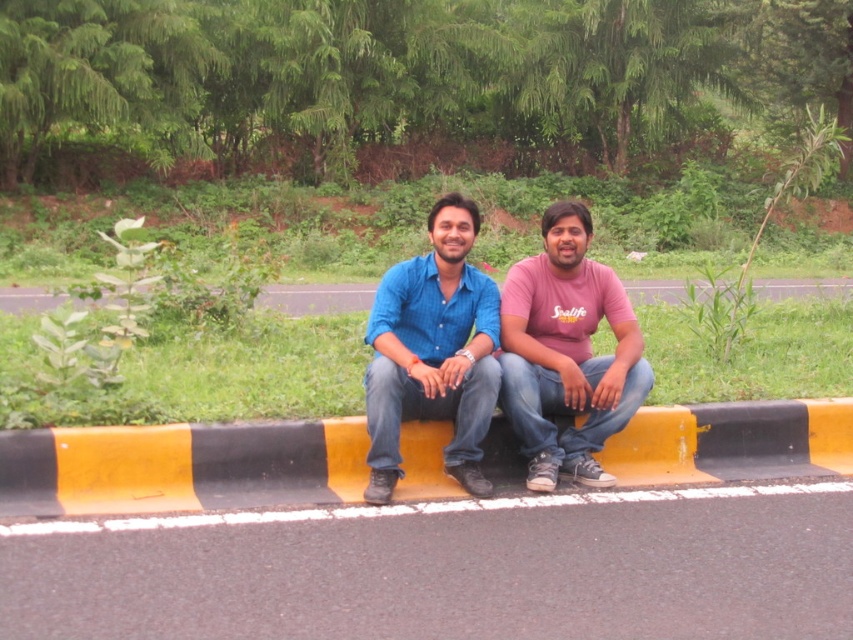
Question: Estimate the real-world distances between objects in this image. Which object is closer to the matte blue shirt at center?

Choices:
 (A) pink matte shirt at center
 (B) yellow/black striped curb at center
 (C) blue denim jeans at center

Answer: (C)

Question: Can you confirm if yellow/black striped curb at center is positioned below blue denim jeans at center?

Choices:
 (A) yes
 (B) no

Answer: (A)

Question: Is yellow/black striped curb at center behind pink matte shirt at center?

Choices:
 (A) yes
 (B) no

Answer: (B)

Question: Considering the real-world distances, which object is farthest from the blue denim jeans at center?

Choices:
 (A) matte blue shirt at center
 (B) pink matte shirt at center
 (C) yellow/black striped curb at center

Answer: (C)

Question: Which point is farther to the camera?

Choices:
 (A) yellow/black striped curb at center
 (B) pink matte shirt at center
 (C) matte blue shirt at center

Answer: (B)

Question: Is blue denim jeans at center further to the viewer compared to pink matte shirt at center?

Choices:
 (A) no
 (B) yes

Answer: (A)